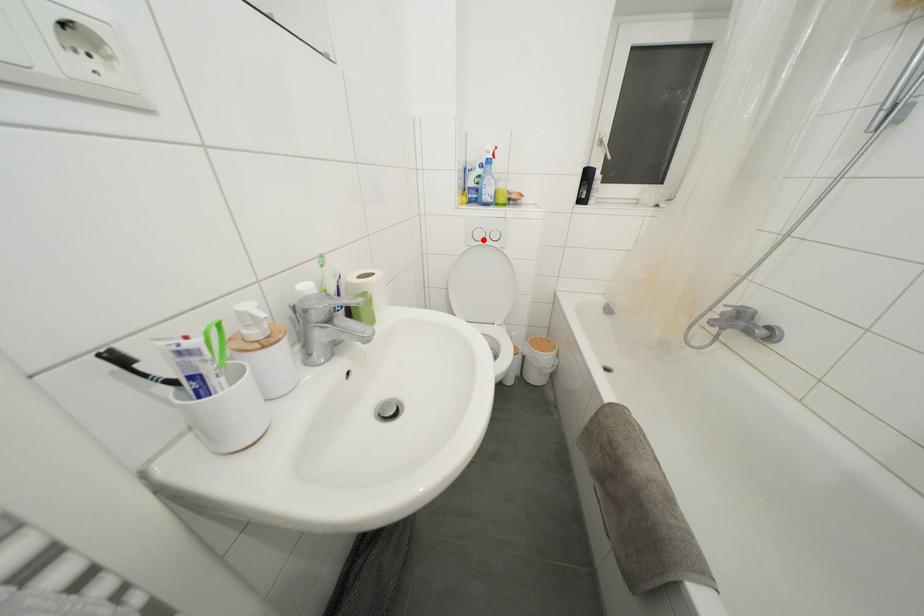
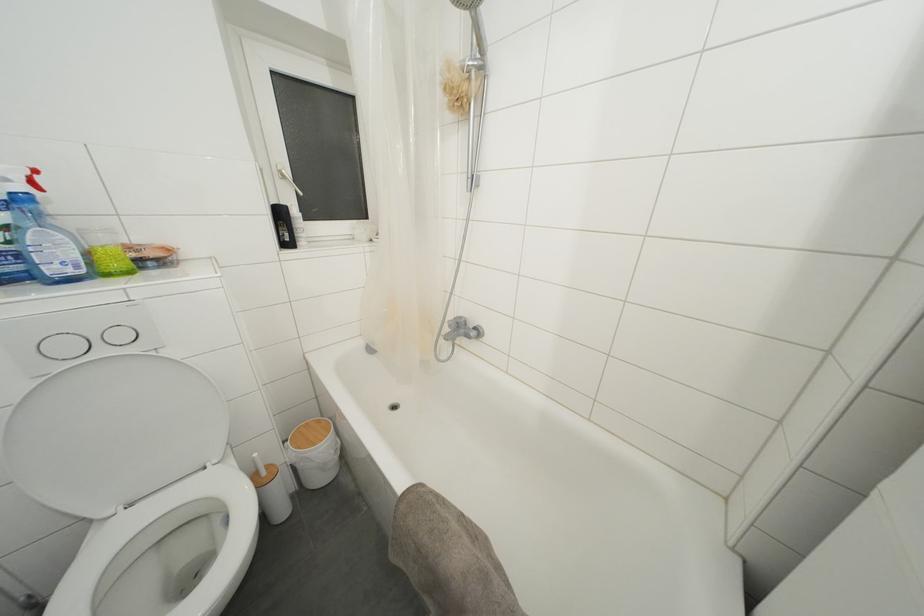
Question: I am providing you with two images of the same scene from different viewpoints. In image1, a red point is highlighted. Considering the same 3D point in image2, which of the following is correct?

Choices:
 (A) It is closer
 (B) It is farther

Answer: (B)